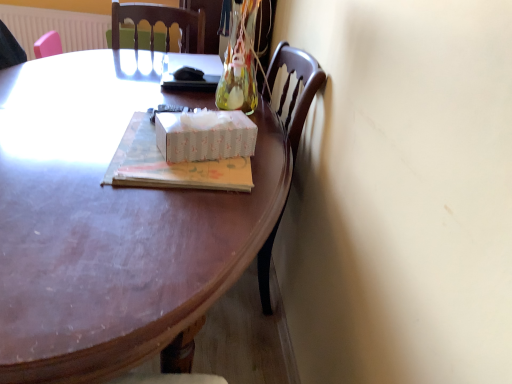
Locate an element on the screen. This screenshot has height=384, width=512. free point in front of matte cardboard book at center is located at coordinates pos(136,220).